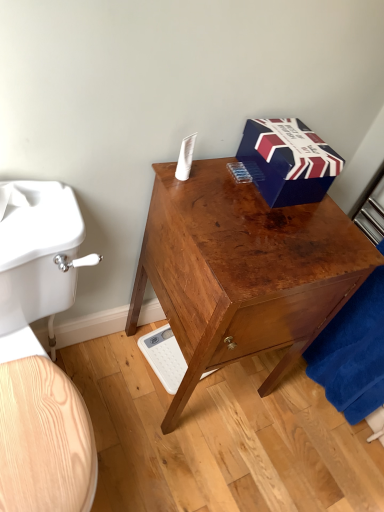
Question: From the image's perspective, is light wood toilet at left located beneath shiny brown wooden desk at center?

Choices:
 (A) no
 (B) yes

Answer: (B)

Question: Can you confirm if light wood toilet at left is wider than shiny brown wooden desk at center?

Choices:
 (A) no
 (B) yes

Answer: (B)

Question: Is the depth of light wood toilet at left less than that of shiny brown wooden desk at center?

Choices:
 (A) yes
 (B) no

Answer: (A)

Question: Does light wood toilet at left come behind shiny brown wooden desk at center?

Choices:
 (A) no
 (B) yes

Answer: (A)

Question: From a real-world perspective, is light wood toilet at left beneath shiny brown wooden desk at center?

Choices:
 (A) no
 (B) yes

Answer: (B)

Question: Considering the relative sizes of light wood toilet at left and shiny brown wooden desk at center in the image provided, is light wood toilet at left bigger than shiny brown wooden desk at center?

Choices:
 (A) yes
 (B) no

Answer: (A)

Question: Can you confirm if light wood toilet at left is smaller than velvety blue towel at lower right?

Choices:
 (A) no
 (B) yes

Answer: (A)

Question: Can you confirm if light wood toilet at left is bigger than velvety blue towel at lower right?

Choices:
 (A) yes
 (B) no

Answer: (A)

Question: From a real-world perspective, does light wood toilet at left stand above velvety blue towel at lower right?

Choices:
 (A) no
 (B) yes

Answer: (A)

Question: Considering the relative sizes of light wood toilet at left and velvety blue towel at lower right in the image provided, is light wood toilet at left thinner than velvety blue towel at lower right?

Choices:
 (A) yes
 (B) no

Answer: (B)

Question: Does light wood toilet at left contain velvety blue towel at lower right?

Choices:
 (A) yes
 (B) no

Answer: (B)

Question: Is velvety blue towel at lower right at the back of light wood toilet at left?

Choices:
 (A) yes
 (B) no

Answer: (B)

Question: Is blue cardboard box at upper right aimed at shiny brown wooden desk at center?

Choices:
 (A) yes
 (B) no

Answer: (B)